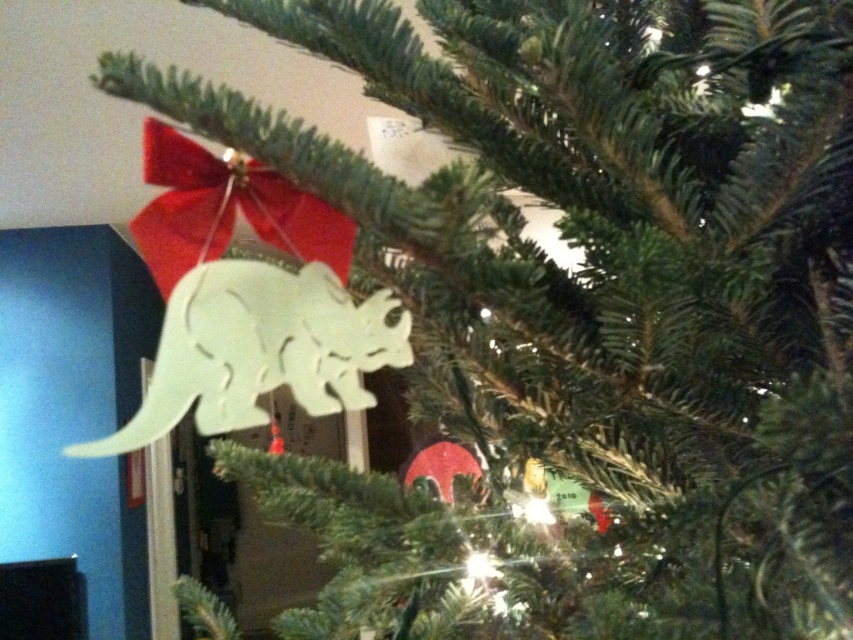
You are standing in front of the Christmas tree and want to place a new ornament exactly at the center of the tree. The current white matte wood dinosaur at center is already placed at coordinates point 0.547, 0.305. Is the dinosaur at the correct position for the center of the tree?

The white matte wood dinosaur at center is located at point (259, 349), which is the exact coordinate specified for the center of the tree. Therefore, the dinosaur is correctly placed at the center.

You are trying to place a new ornament on the Christmas tree. You have a small star decoration that can only fit in spaces wider than the existing ornaments. Which of the two dinosaurs, the white matte wood dinosaur at center or the matte white dinosaur at upper center, has a wider base to accommodate the star?

The white matte wood dinosaur at center might be wider than the matte white dinosaur at upper center, so it could potentially accommodate the star decoration better.